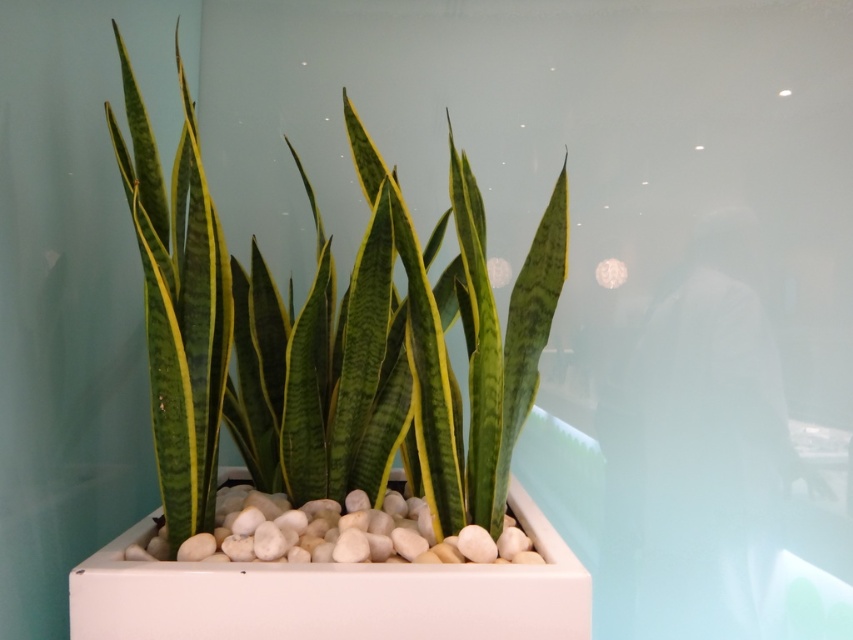
Consider the image. Does green glossy leaves at center have a lesser height compared to green textured leaves at center?

Yes.

Can you confirm if green glossy leaves at center is positioned above green textured leaves at center?

No.

Image resolution: width=853 pixels, height=640 pixels. What do you see at coordinates (331, 340) in the screenshot?
I see `green glossy leaves at center` at bounding box center [331, 340].

The height and width of the screenshot is (640, 853). What are the coordinates of `green glossy leaves at center` in the screenshot? It's located at (331, 340).